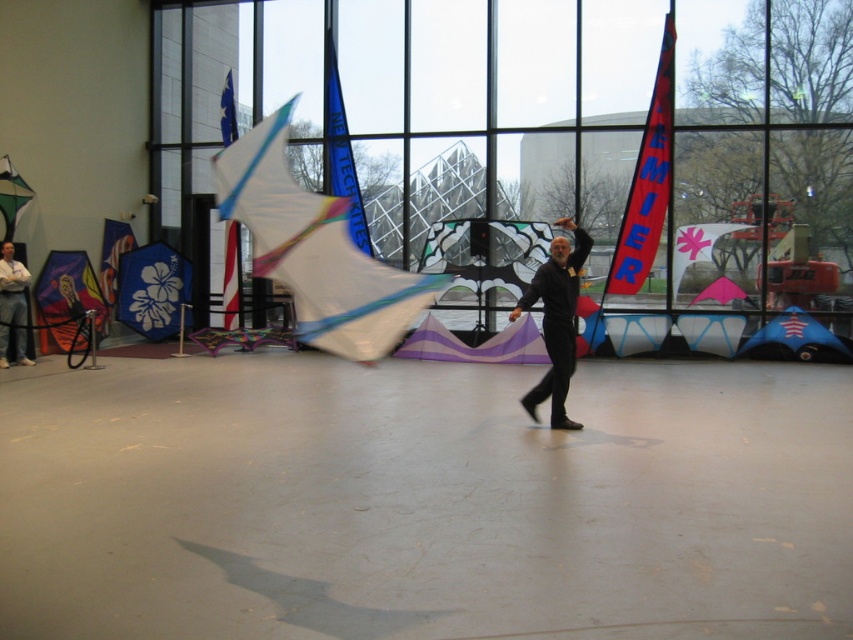
Measure the distance from transparent glass window at center to black matte pants at center.

transparent glass window at center is 6.85 meters away from black matte pants at center.

Between transparent glass window at center and black matte pants at center, which one appears on the left side from the viewer's perspective?

transparent glass window at center is more to the left.

Is point (453, 179) more distant than point (549, 332)?

Yes, point (453, 179) is behind point (549, 332).

At what (x,y) coordinates should I click in order to perform the action: click on transparent glass window at center. Please return your answer as a coordinate pair (x, y). The height and width of the screenshot is (640, 853). Looking at the image, I should click on (610, 131).

Who is taller, transparent glass window at center or denim jeans at left?

Standing taller between the two is transparent glass window at center.

Identify the location of transparent glass window at center. (610, 131).

What do you see at coordinates (610, 131) in the screenshot? I see `transparent glass window at center` at bounding box center [610, 131].

You are a GUI agent. You are given a task and a screenshot of the screen. Output one action in this format:
    pyautogui.click(x=<x>, y=<y>)
    Task: Click on the transparent glass window at center
    
    Given the screenshot: What is the action you would take?
    [610, 131]

Is point (556, 268) positioned behind point (0, 362)?

No, it is in front of (0, 362).

Can you confirm if black matte pants at center is smaller than denim jeans at left?

Actually, black matte pants at center might be larger than denim jeans at left.

Find the location of a particular element. black matte pants at center is located at coordinates (556, 321).

At what (x,y) coordinates should I click in order to perform the action: click on black matte pants at center. Please return your answer as a coordinate pair (x, y). This screenshot has height=640, width=853. Looking at the image, I should click on (556, 321).